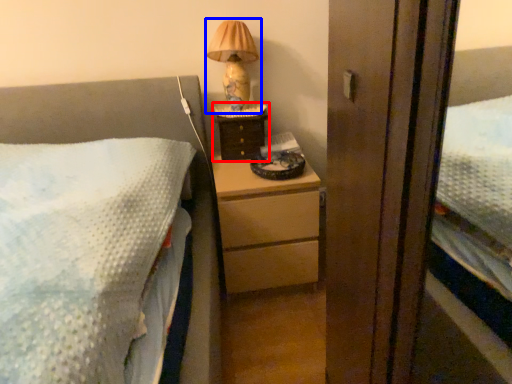
Question: Among these objects, which one is nearest to the camera, nightstand (highlighted by a red box) or table lamp (highlighted by a blue box)?

Choices:
 (A) nightstand
 (B) table lamp

Answer: (B)